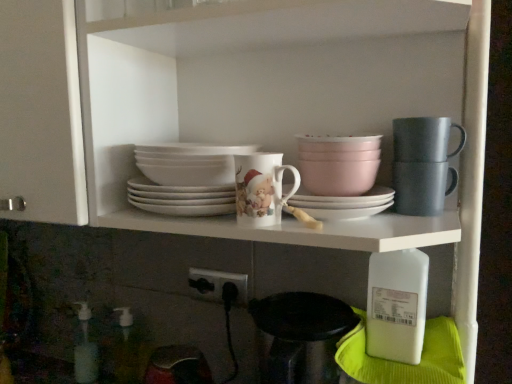
Question: Is there a large distance between matte gray mug at upper right and white matte platter at center?

Choices:
 (A) no
 (B) yes

Answer: (A)

Question: From a real-world perspective, is matte gray mug at upper right positioned over white matte platter at center based on gravity?

Choices:
 (A) no
 (B) yes

Answer: (B)

Question: Is matte gray mug at upper right thinner than white matte platter at center?

Choices:
 (A) no
 (B) yes

Answer: (B)

Question: Does matte gray mug at upper right come behind white matte platter at center?

Choices:
 (A) yes
 (B) no

Answer: (A)

Question: Is matte gray mug at upper right oriented away from white matte platter at center?

Choices:
 (A) no
 (B) yes

Answer: (A)

Question: Does matte gray mug at upper right appear on the right side of white matte platter at center?

Choices:
 (A) yes
 (B) no

Answer: (A)

Question: Is porcelain cup at center at the back of white plastic bottle at lower right, which appears as the first bottle when viewed from the front?

Choices:
 (A) no
 (B) yes

Answer: (A)

Question: Are white plastic bottle at lower right, which appears as the first bottle when viewed from the front, and porcelain cup at center making contact?

Choices:
 (A) yes
 (B) no

Answer: (B)

Question: Does white plastic bottle at lower right, which appears as the first bottle when viewed from the front, contain porcelain cup at center?

Choices:
 (A) no
 (B) yes

Answer: (A)

Question: Can you confirm if white plastic bottle at lower right, placed as the 3th bottle when sorted from left to right, is positioned to the left of porcelain cup at center?

Choices:
 (A) no
 (B) yes

Answer: (A)

Question: Is white plastic bottle at lower right, marked as the first bottle in a right-to-left arrangement, shorter than porcelain cup at center?

Choices:
 (A) no
 (B) yes

Answer: (A)

Question: Is white plastic bottle at lower right, marked as the first bottle in a right-to-left arrangement, at the right side of porcelain cup at center?

Choices:
 (A) yes
 (B) no

Answer: (A)

Question: Can you confirm if white matte platter at center is positioned to the right of matte gray mug at upper right, arranged as the first tableware when viewed from the right?

Choices:
 (A) no
 (B) yes

Answer: (A)